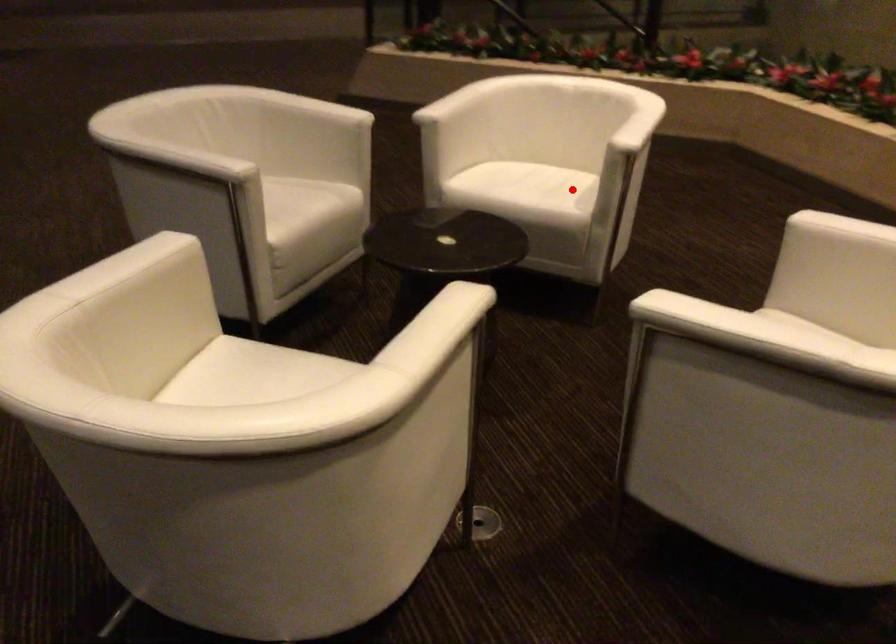
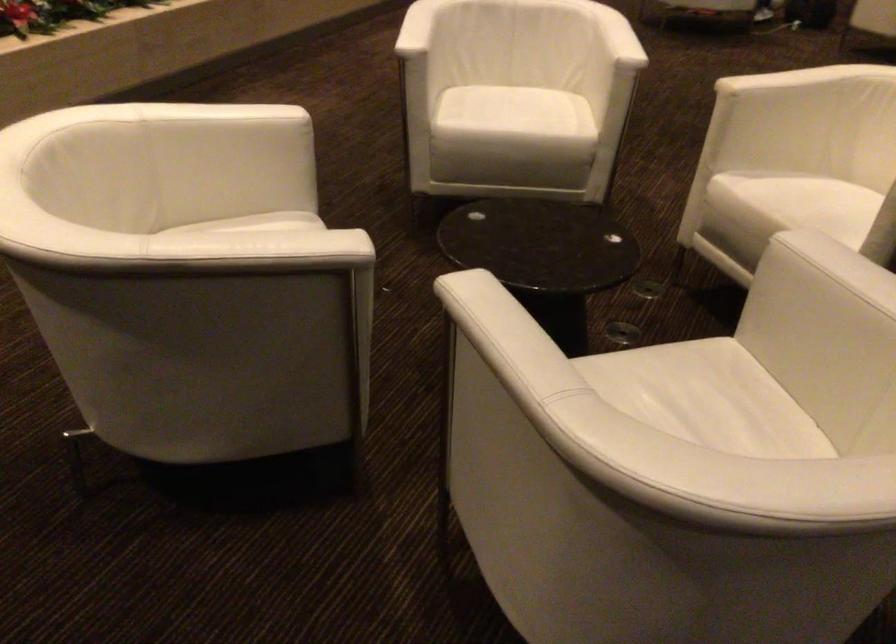
Question: I am providing you with two images of the same scene from different viewpoints. Given a red point in image1, look at the same physical point in image2. Is it:

Choices:
 (A) Closer to the viewpoint
 (B) Farther from the viewpoint

Answer: (A)